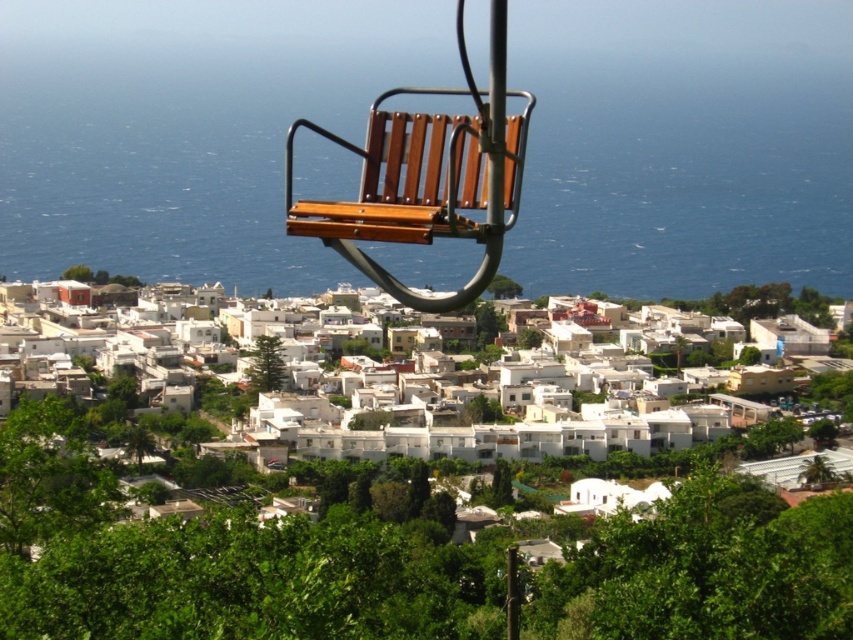
Question: Which point is farther from the camera taking this photo?

Choices:
 (A) (368, 228)
 (B) (73, 186)
 (C) (456, 444)

Answer: (B)

Question: Does blue water at center appear under white matte buildings at center?

Choices:
 (A) yes
 (B) no

Answer: (B)

Question: Which is farther from the wooden bench at center?

Choices:
 (A) blue water at center
 (B) white matte buildings at center

Answer: (B)

Question: Estimate the real-world distances between objects in this image. Which object is closer to the blue water at center?

Choices:
 (A) white matte buildings at center
 (B) wooden bench at center

Answer: (A)

Question: Is blue water at center closer to the viewer compared to white matte buildings at center?

Choices:
 (A) yes
 (B) no

Answer: (A)

Question: Does blue water at center have a larger size compared to white matte buildings at center?

Choices:
 (A) yes
 (B) no

Answer: (A)